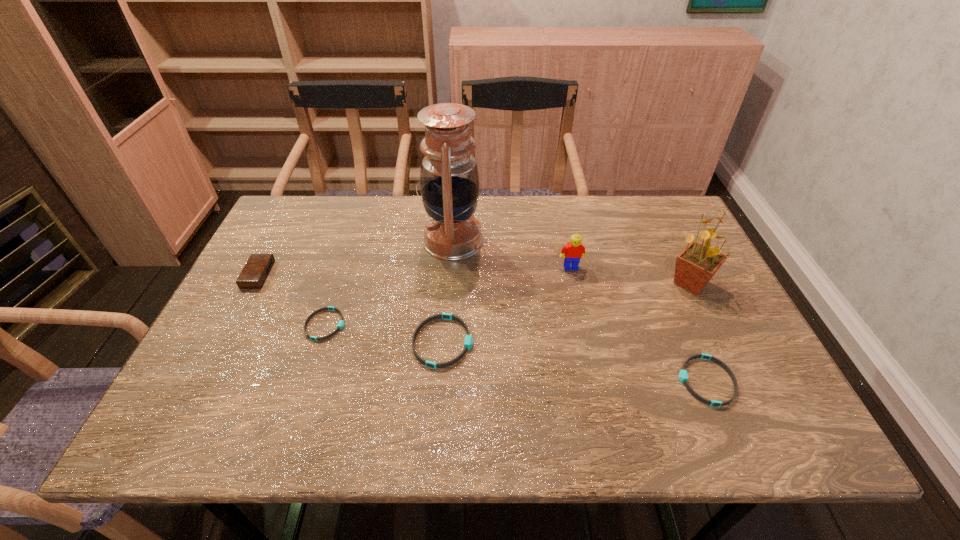
This screenshot has width=960, height=540. I want to click on free space located at the front of the sunflower with flowers visible, so click(x=552, y=284).

You are a GUI agent. You are given a task and a screenshot of the screen. Output one action in this format:
    pyautogui.click(x=<x>, y=<y>)
    Task: Click on the free space located on the front-facing side of the fifth object from left to right
    
    Given the screenshot: What is the action you would take?
    pyautogui.click(x=599, y=395)

Locate an element on the screen. Image resolution: width=960 pixels, height=540 pixels. free point located 0.120m on the front face of the fourth shortest object is located at coordinates point(313,275).

This screenshot has height=540, width=960. Find the location of `object at the far edge`. object at the far edge is located at coordinates (449, 182).

This screenshot has width=960, height=540. Find the location of `object located in the left edge section of the desktop`. object located in the left edge section of the desktop is located at coordinates (256, 270).

This screenshot has height=540, width=960. Find the location of `wristband situated at the right edge`. wristband situated at the right edge is located at coordinates (683, 375).

Locate an element on the screen. The height and width of the screenshot is (540, 960). sunflower at the right edge is located at coordinates (695, 266).

In order to click on object present at the near right corner in this screenshot , I will do `click(683, 375)`.

Find the location of `vacant space at the far edge of the desktop`. vacant space at the far edge of the desktop is located at coordinates (401, 196).

The height and width of the screenshot is (540, 960). I want to click on free space at the near edge of the desktop, so click(625, 397).